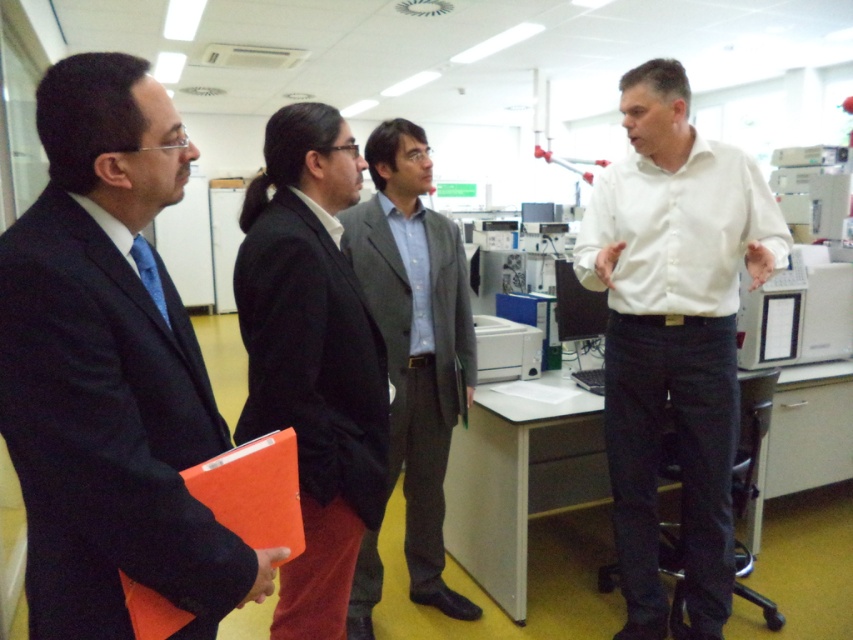
You are an interior designer assessing the layout of this room. The black suit at left and the orange matte folder at lower left are both placed in the room. Which object occupies a larger vertical space in the room?

The black suit at left is much taller than the orange matte folder at lower left, so it occupies a larger vertical space in the room.

You are standing at the origin point in the laboratory. You see two points marked on the floor at coordinates point (265, 186) and point (451, 410). If you walk straight ahead, which point will you reach first?

Point (265, 186) is in front of point (451, 410), so you will reach point (265, 186) first.